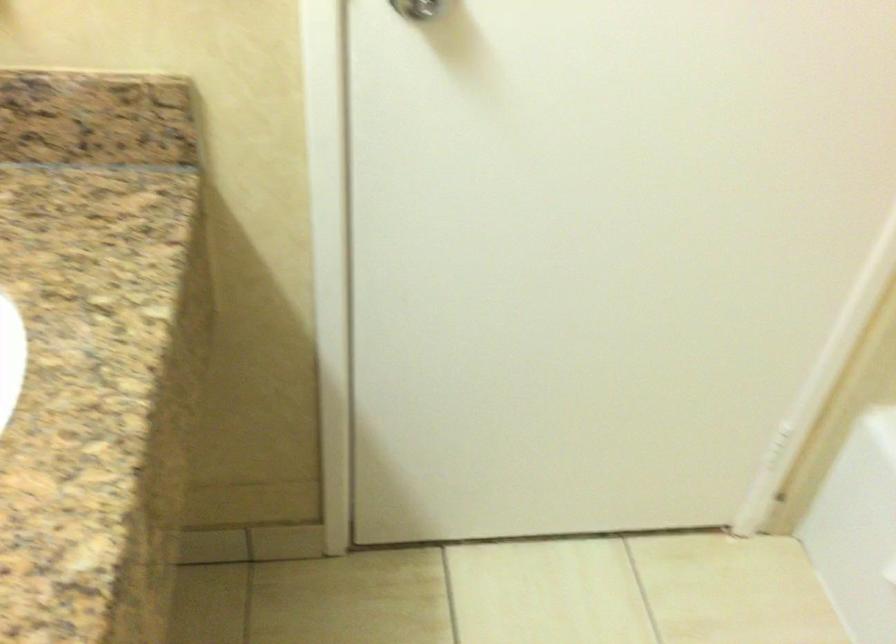
The width and height of the screenshot is (896, 644). What do you see at coordinates (417, 8) in the screenshot?
I see `the metal door knob` at bounding box center [417, 8].